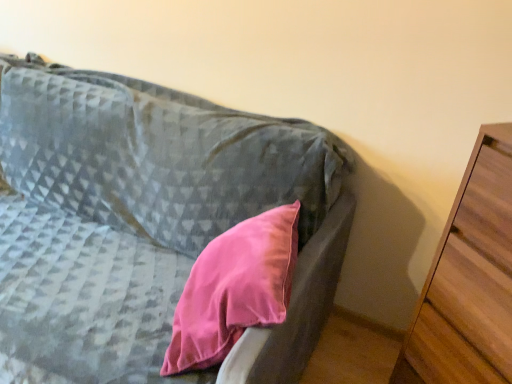
Question: Does wooden chest of drawers at right have a greater width compared to matte gray couch at center?

Choices:
 (A) no
 (B) yes

Answer: (A)

Question: Does wooden chest of drawers at right have a lesser height compared to matte gray couch at center?

Choices:
 (A) no
 (B) yes

Answer: (A)

Question: Does wooden chest of drawers at right contain matte gray couch at center?

Choices:
 (A) yes
 (B) no

Answer: (B)

Question: Is wooden chest of drawers at right located outside matte gray couch at center?

Choices:
 (A) no
 (B) yes

Answer: (B)

Question: From the image's perspective, is wooden chest of drawers at right below matte gray couch at center?

Choices:
 (A) yes
 (B) no

Answer: (A)

Question: Does wooden chest of drawers at right turn towards matte gray couch at center?

Choices:
 (A) yes
 (B) no

Answer: (A)

Question: From a real-world perspective, is matte gray couch at center beneath wooden chest of drawers at right?

Choices:
 (A) no
 (B) yes

Answer: (B)

Question: Is matte gray couch at center facing away from wooden chest of drawers at right?

Choices:
 (A) no
 (B) yes

Answer: (A)

Question: Considering the relative sizes of matte gray couch at center and wooden chest of drawers at right in the image provided, is matte gray couch at center wider than wooden chest of drawers at right?

Choices:
 (A) no
 (B) yes

Answer: (B)

Question: Is matte gray couch at center in contact with wooden chest of drawers at right?

Choices:
 (A) yes
 (B) no

Answer: (B)

Question: Is matte gray couch at center to the left of wooden chest of drawers at right from the viewer's perspective?

Choices:
 (A) yes
 (B) no

Answer: (A)

Question: Is matte gray couch at center positioned before wooden chest of drawers at right?

Choices:
 (A) no
 (B) yes

Answer: (B)

Question: In terms of height, does matte gray couch at center look taller or shorter compared to wooden chest of drawers at right?

Choices:
 (A) tall
 (B) short

Answer: (B)